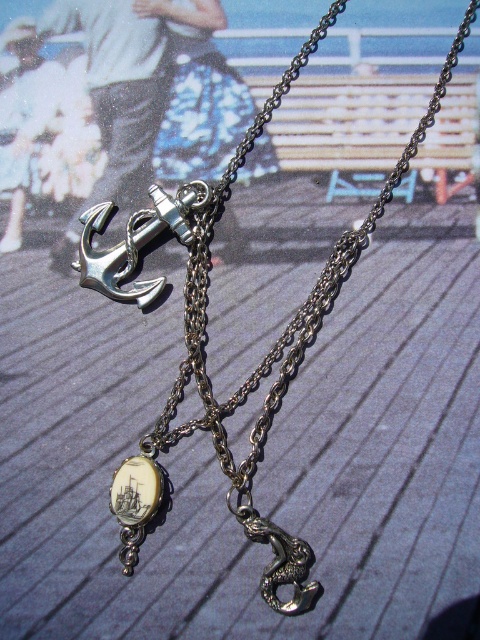
The height and width of the screenshot is (640, 480). What do you see at coordinates (278, 337) in the screenshot? I see `antique silver anchor at center` at bounding box center [278, 337].

From the picture: Does antique silver anchor at center appear on the right side of ivory/shell-like ship at center?

Indeed, antique silver anchor at center is positioned on the right side of ivory/shell-like ship at center.

Does point (301, 324) lie behind point (147, 493)?

That is True.

Locate an element on the screen. antique silver anchor at center is located at coordinates (278, 337).

Between silver metallic anchor at upper left and ivory/shell-like ship at center, which one has more height?

With more height is silver metallic anchor at upper left.

Is silver metallic anchor at upper left bigger than ivory/shell-like ship at center?

Indeed, silver metallic anchor at upper left has a larger size compared to ivory/shell-like ship at center.

Is point (120, 291) positioned behind point (119, 516)?

Yes.

Locate an element on the screen. Image resolution: width=480 pixels, height=640 pixels. silver metallic anchor at upper left is located at coordinates (135, 241).

Does point (280, 394) lie in front of point (97, 209)?

Yes, point (280, 394) is closer to viewer.

Who is lower down, antique silver anchor at center or silver metallic anchor at upper left?

antique silver anchor at center is below.

Who is more forward, (x=214, y=211) or (x=108, y=257)?

Point (x=108, y=257) is in front.

Find the location of a particular element. antique silver anchor at center is located at coordinates (278, 337).